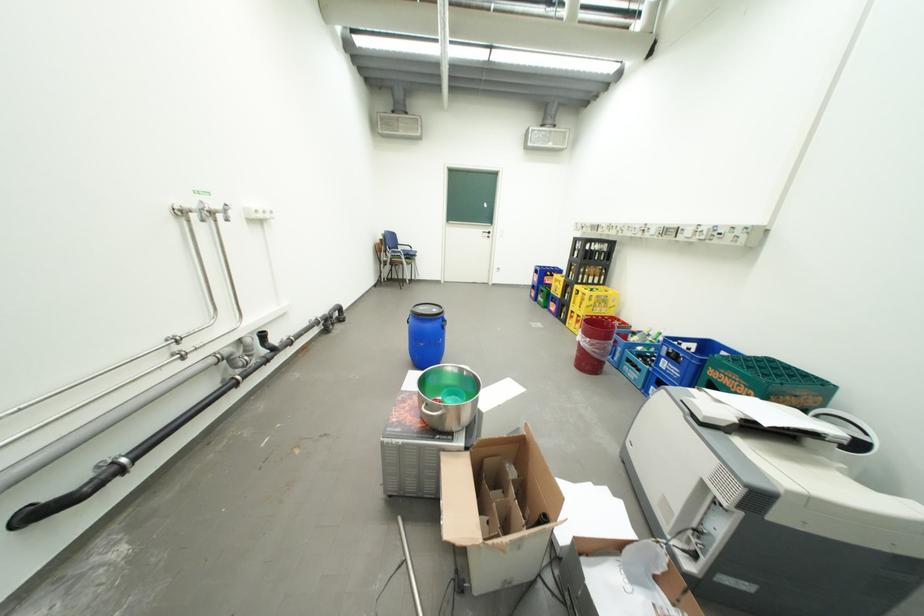
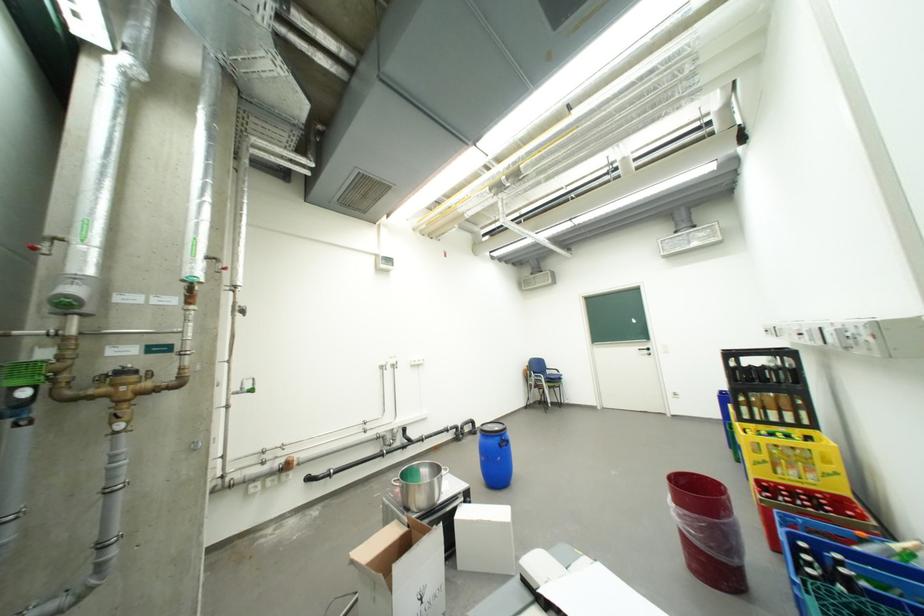
Locate, in the second image, the point that corresponds to point 611,314 in the first image.

(810, 484)